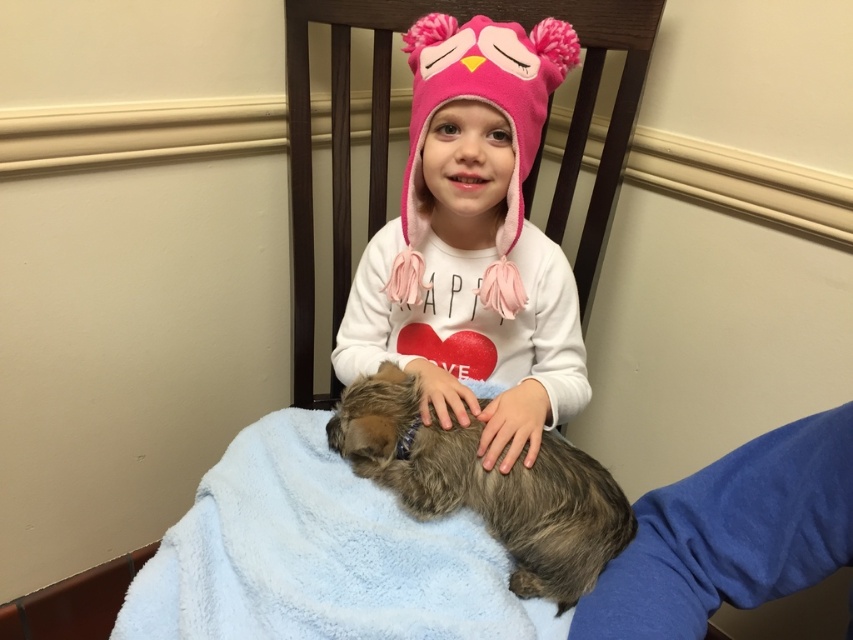
Based on the photo, is pink fuzzy hat at center below blue soft blanket at lower center?

Incorrect, pink fuzzy hat at center is not positioned below blue soft blanket at lower center.

Identify the location of pink fuzzy hat at center. This screenshot has height=640, width=853. (473, 241).

Locate an element on the screen. pink fuzzy hat at center is located at coordinates (473, 241).

Does point (520, 253) come behind point (405, 429)?

Yes, point (520, 253) is farther from viewer.

Image resolution: width=853 pixels, height=640 pixels. Identify the location of pink fuzzy hat at center. (473, 241).

Does blue soft blanket at lower center appear under fluffy brown dog at center?

Answer: Yes.

Is blue soft blanket at lower center to the right of fluffy brown dog at center from the viewer's perspective?

Incorrect, blue soft blanket at lower center is not on the right side of fluffy brown dog at center.

The image size is (853, 640). Identify the location of blue soft blanket at lower center. pyautogui.click(x=320, y=556).

At what (x,y) coordinates should I click in order to perform the action: click on blue soft blanket at lower center. Please return your answer as a coordinate pair (x, y). This screenshot has height=640, width=853. Looking at the image, I should click on (320, 556).